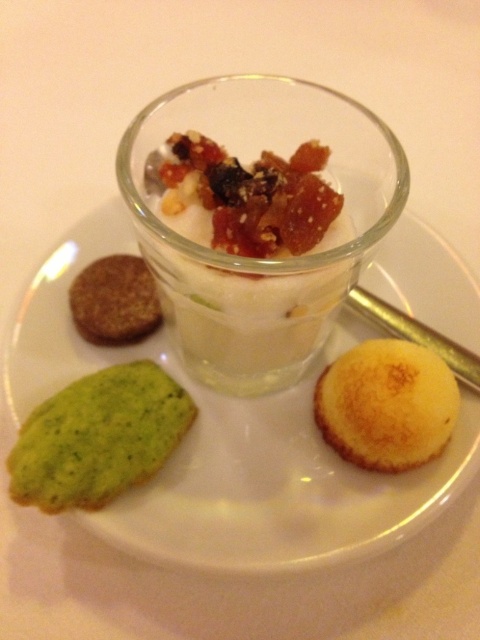
You are a dessert lover trying to grab the closest cookie to you. You see the translucent glass dessert at center and the golden brown sponge cake at lower right. Which one is nearer to you?

The translucent glass dessert at center is closer to the viewer than the golden brown sponge cake at lower right, so you should grab the translucent glass dessert at center.

You are a dessert lover who wants to know if the translucent glass dessert at center can fit entirely on top of the golden brown sponge cake at lower right. Based on their sizes, what do you think?

The translucent glass dessert at center is larger in size than the golden brown sponge cake at lower right, so it cannot fit entirely on top of it.